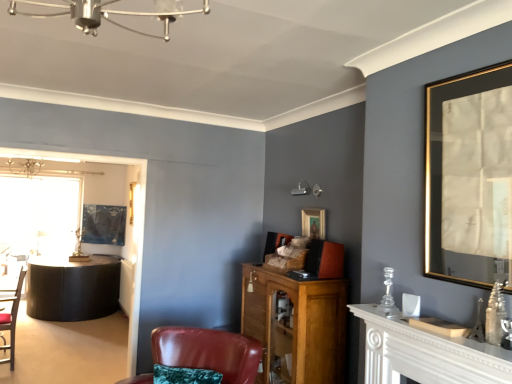
Question: Is white wooden mantelpiece at right not near wooden cabinet at center?

Choices:
 (A) no
 (B) yes

Answer: (A)

Question: Is white wooden mantelpiece at right further to the viewer compared to wooden cabinet at center?

Choices:
 (A) no
 (B) yes

Answer: (A)

Question: Does white wooden mantelpiece at right have a greater height compared to wooden cabinet at center?

Choices:
 (A) yes
 (B) no

Answer: (B)

Question: Is white wooden mantelpiece at right facing away from wooden cabinet at center?

Choices:
 (A) no
 (B) yes

Answer: (A)

Question: Could wooden cabinet at center be considered to be inside white wooden mantelpiece at right?

Choices:
 (A) yes
 (B) no

Answer: (B)

Question: Is wooden picture frame at center, acting as the second picture frame starting from the back, in front of or behind leather armchair at center, the first chair from the right, in the image?

Choices:
 (A) behind
 (B) front

Answer: (A)

Question: From the image's perspective, is wooden picture frame at center, marked as the second picture frame in a right-to-left arrangement, located above or below leather armchair at center, which is counted as the second chair, starting from the back?

Choices:
 (A) above
 (B) below

Answer: (A)

Question: From their relative heights in the image, would you say wooden picture frame at center, marked as the second picture frame in a right-to-left arrangement, is taller or shorter than leather armchair at center, which is counted as the second chair, starting from the back?

Choices:
 (A) short
 (B) tall

Answer: (A)

Question: Considering the positions of wooden picture frame at center, marked as the second picture frame in a right-to-left arrangement, and leather armchair at center, which is counted as the second chair, starting from the back, in the image, is wooden picture frame at center, marked as the second picture frame in a right-to-left arrangement, wider or thinner than leather armchair at center, which is counted as the second chair, starting from the back,?

Choices:
 (A) wide
 (B) thin

Answer: (B)

Question: Considering the positions of wooden cabinet at center and gold-framed mirror at upper right, placed as the 1th picture frame when sorted from front to back, in the image, is wooden cabinet at center taller or shorter than gold-framed mirror at upper right, placed as the 1th picture frame when sorted from front to back,?

Choices:
 (A) tall
 (B) short

Answer: (A)

Question: Considering their positions, is wooden cabinet at center located in front of or behind gold-framed mirror at upper right, the 3th picture frame positioned from the left?

Choices:
 (A) behind
 (B) front

Answer: (A)

Question: Is wooden cabinet at center spatially inside gold-framed mirror at upper right, placed as the 1th picture frame when sorted from front to back, or outside of it?

Choices:
 (A) outside
 (B) inside

Answer: (A)

Question: Based on their sizes in the image, would you say wooden cabinet at center is bigger or smaller than gold-framed mirror at upper right, placed as the 1th picture frame when sorted from front to back?

Choices:
 (A) big
 (B) small

Answer: (A)

Question: Looking at their shapes, would you say transparent glass table at left is wider or thinner than wooden cabinet at center?

Choices:
 (A) wide
 (B) thin

Answer: (B)

Question: Is transparent glass table at left to the left or to the right of wooden cabinet at center in the image?

Choices:
 (A) right
 (B) left

Answer: (B)